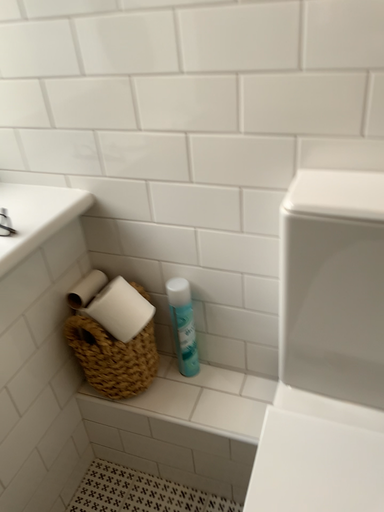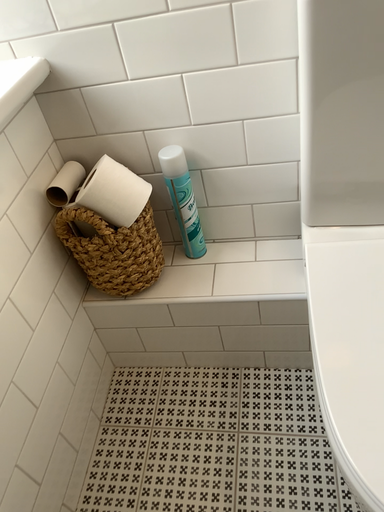
Question: How did the camera likely rotate when shooting the video?

Choices:
 (A) rotated left
 (B) rotated right

Answer: (B)